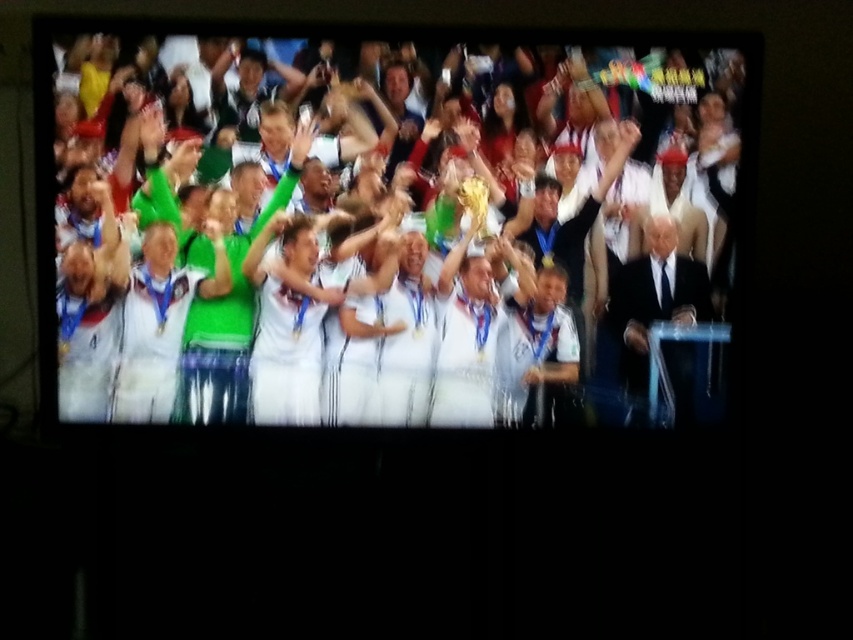
You are a photographer at the event and want to capture both the white jersey trophy at center and the gold shiny trophy at center in a single photo. Which trophy should you focus on first to ensure both are in frame?

The white jersey trophy at center is below the gold shiny trophy at center, so you should focus on the gold shiny trophy at center first to ensure both are in frame.

You are a photographer standing in front of the television screen. You want to take a photo of the gold shiny trophy at center and the black suit at right. How far apart are these two objects in the image?

The black suit at right is 12.82 inches from the gold shiny trophy at center, so the distance between them is 12.82 inches.

You are a photographer at the event and need to capture both the black suit at right and the gold shiny trophy at center in a single shot. Given that your camera has a limited zoom range, which object should you focus on to ensure both are visible without cropping?

You should focus on the black suit at right because it is larger in size than the gold shiny trophy at center, allowing it to remain visible even with limited zoom while the smaller trophy would still fit into the frame.